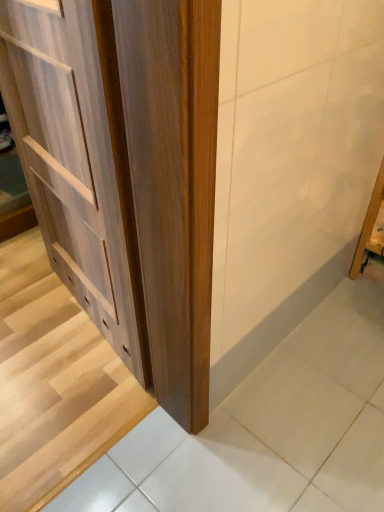
Question: In the image, is light wood cabinet at left positioned in front of or behind wooden door at center?

Choices:
 (A) behind
 (B) front

Answer: (B)

Question: Is light wood cabinet at left taller or shorter than wooden door at center?

Choices:
 (A) tall
 (B) short

Answer: (A)

Question: In terms of width, does light wood cabinet at left look wider or thinner when compared to wooden door at center?

Choices:
 (A) thin
 (B) wide

Answer: (A)

Question: From a real-world perspective, relative to light wood cabinet at left, is wooden door at center vertically above or below?

Choices:
 (A) below
 (B) above

Answer: (A)

Question: From their relative heights in the image, would you say wooden door at center is taller or shorter than light wood cabinet at left?

Choices:
 (A) tall
 (B) short

Answer: (B)

Question: Considering the positions of wooden door at center and light wood cabinet at left in the image, is wooden door at center wider or thinner than light wood cabinet at left?

Choices:
 (A) wide
 (B) thin

Answer: (A)

Question: From the image's perspective, is wooden door at center positioned above or below light wood cabinet at left?

Choices:
 (A) below
 (B) above

Answer: (A)